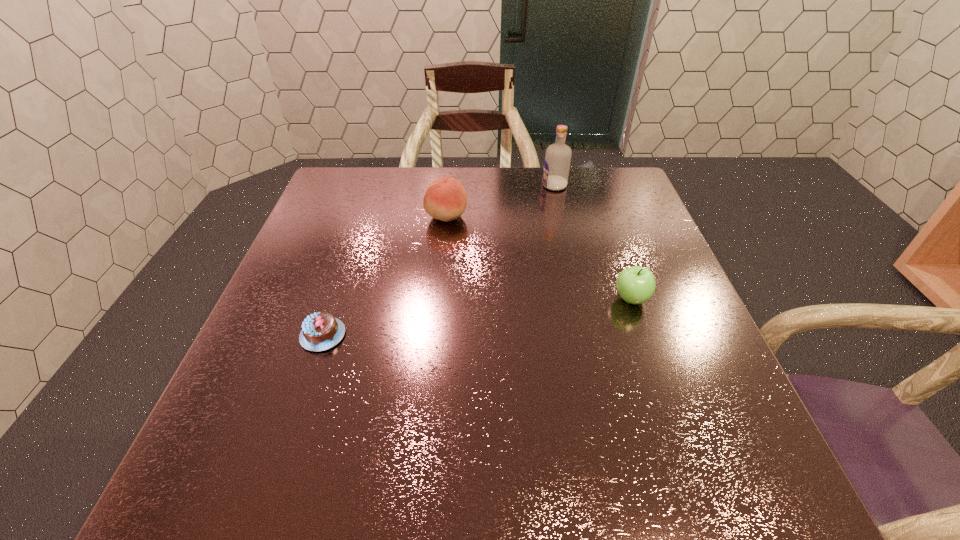
At what (x,y) coordinates should I click in order to perform the action: click on vacant space that's between the third farthest object and the third object from left to right. Please return your answer as a coordinate pair (x, y). The width and height of the screenshot is (960, 540). Looking at the image, I should click on (592, 242).

Find the location of a particular element. This screenshot has height=540, width=960. free space between the nearest object and the tallest object is located at coordinates coord(439,260).

Find the location of a particular element. Image resolution: width=960 pixels, height=540 pixels. blank region between the leftmost object and the second tallest object is located at coordinates 385,275.

At what (x,y) coordinates should I click in order to perform the action: click on free space between the vodka and the third tallest object. Please return your answer as a coordinate pair (x, y). The height and width of the screenshot is (540, 960). Looking at the image, I should click on (592, 242).

The width and height of the screenshot is (960, 540). I want to click on unoccupied position between the third shortest object and the apple, so (539, 257).

Choose which object is the nearest neighbor to the apple. Please provide its 2D coordinates. Your answer should be formatted as a tuple, i.e. [(x, y)], where the tuple contains the x and y coordinates of a point satisfying the conditions above.

[(445, 199)]

Identify which object is the second closest to the chocolate cake. Please provide its 2D coordinates. Your answer should be formatted as a tuple, i.e. [(x, y)], where the tuple contains the x and y coordinates of a point satisfying the conditions above.

[(636, 284)]

Image resolution: width=960 pixels, height=540 pixels. I want to click on free spot that satisfies the following two spatial constraints: 1. on the label of the vodka; 2. on the back side of the apple, so click(x=581, y=299).

I want to click on vacant region that satisfies the following two spatial constraints: 1. on the back side of the leftmost object; 2. on the right side of the apple, so click(x=335, y=299).